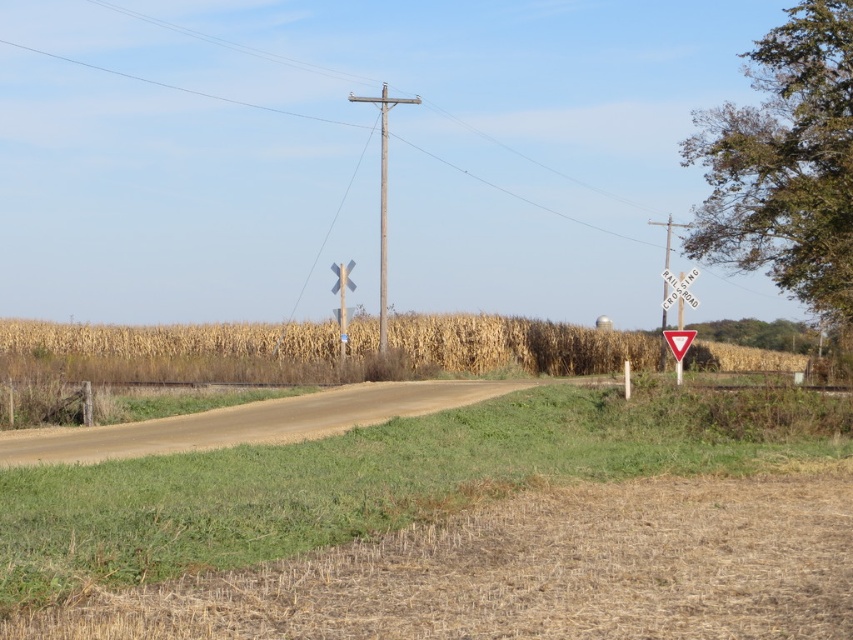
You are a farmer checking the field. You notice the golden dry corn at center and the metallic pole at right. Which object would block your view more if you were standing in front of them?

The golden dry corn at center is larger in size than the metallic pole at right, so it would block your view more.

You are a hiker trying to navigate through the rural area shown in the image. You see a metallic pole at right and a red plastic triangle at center. Which object would appear larger in your field of view?

The metallic pole at right is much taller than the red plastic triangle at center, so it would appear larger in your field of view.